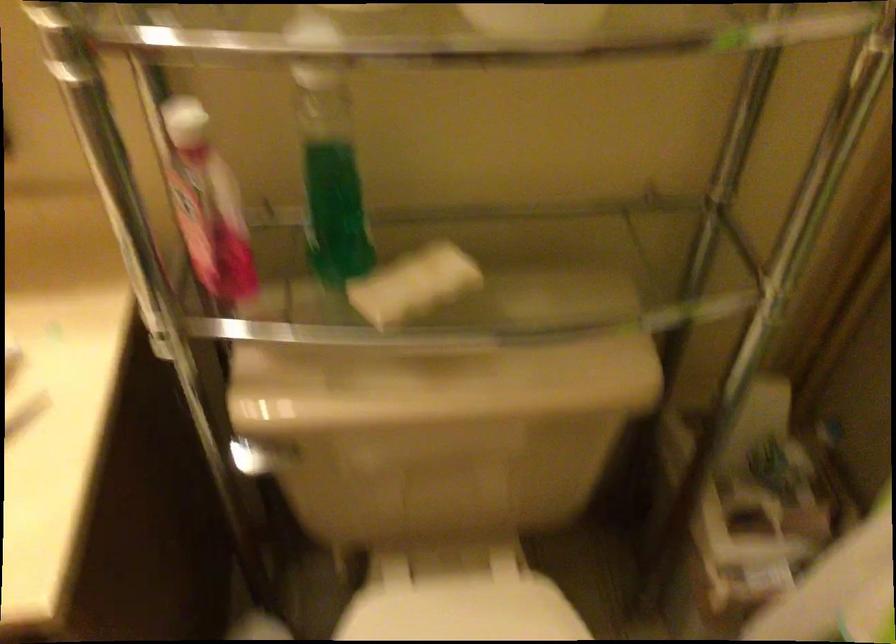
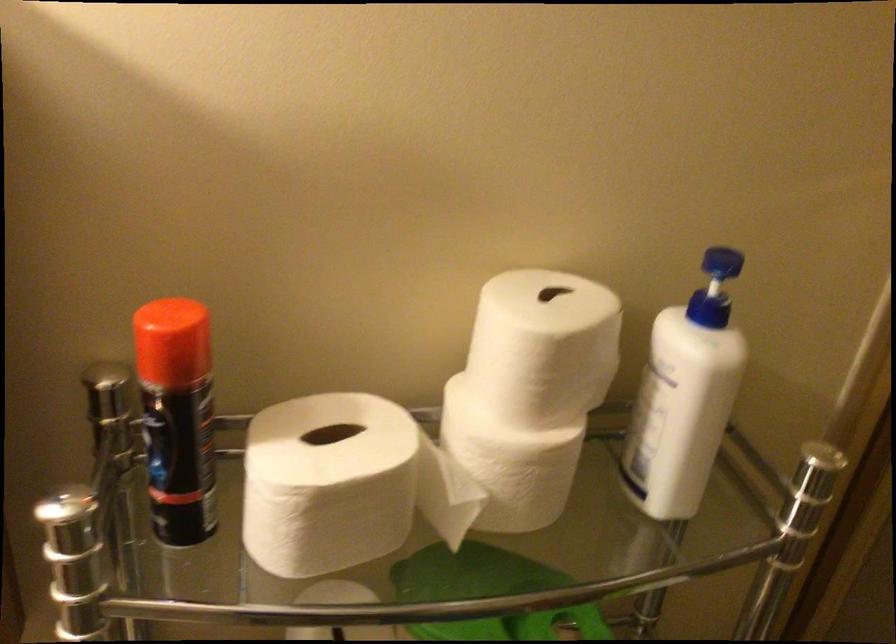
Question: The images are taken continuously from a first-person perspective. In which direction is your viewpoint rotating?

Choices:
 (A) Left
 (B) Right
 (C) Up
 (D) Down

Answer: (C)